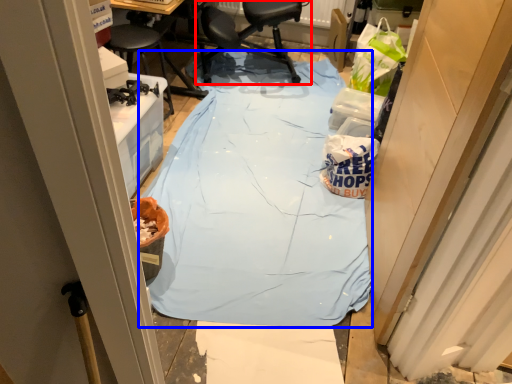
Question: Among these objects, which one is nearest to the camera, chair (highlighted by a red box) or tablecloth (highlighted by a blue box)?

Choices:
 (A) chair
 (B) tablecloth

Answer: (B)